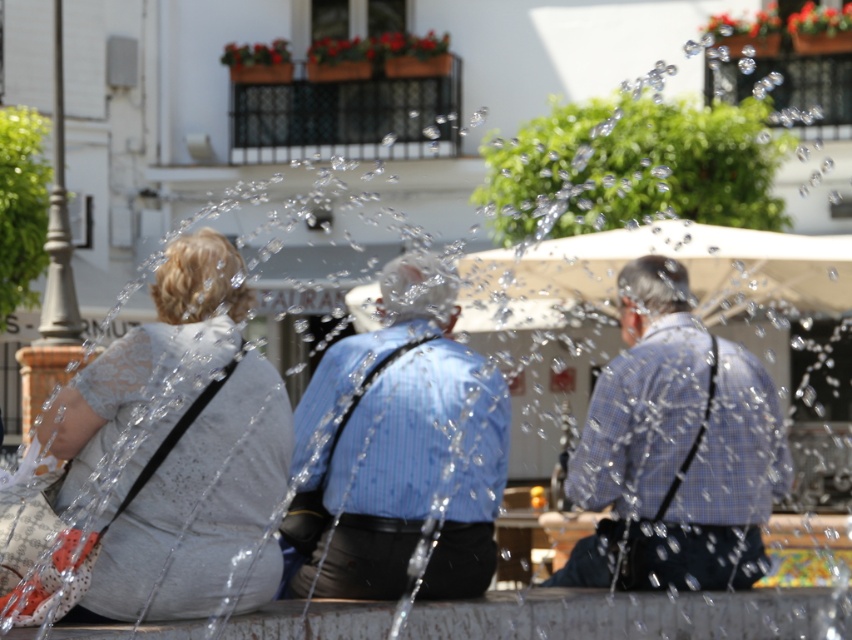
You are a photographer trying to capture a candid shot of both the blue striped shirt at center and the blue checkered shirt at center. Since you want to ensure both are visible in the frame, which person should you adjust your focus on to include both?

The blue striped shirt at center is in front of the blue checkered shirt at center, so you should focus on the blue checkered shirt at center to ensure both are visible in the frame.

You are a photographer standing in front of the fountain and see the white dotted fabric at left and the blue striped shirt at center. Which object is covering the other one?

The white dotted fabric at left is positioned over the blue striped shirt at center, so it is covering the other object.